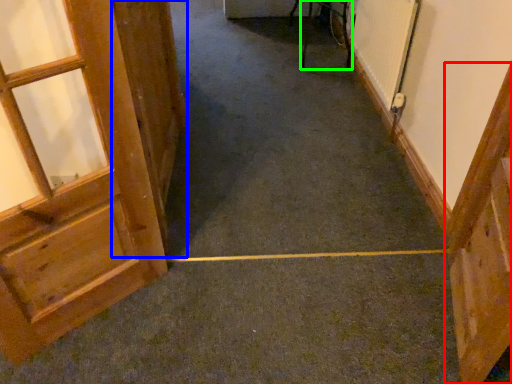
Question: Based on their relative distances, which object is farther from door (highlighted by a red box)? Choose from door (highlighted by a blue box) and furniture (highlighted by a green box).

Choices:
 (A) door
 (B) furniture

Answer: (B)